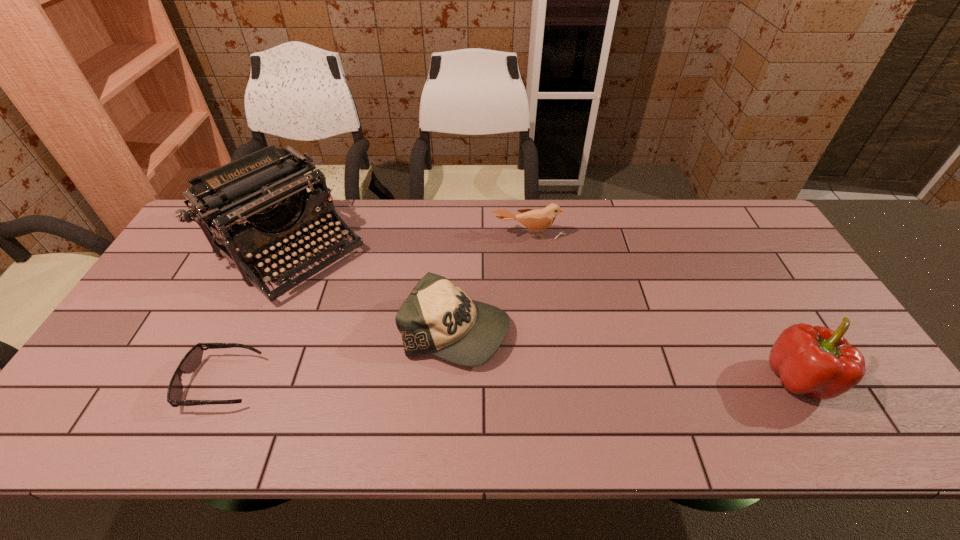
You are a GUI agent. You are given a task and a screenshot of the screen. Output one action in this format:
    pyautogui.click(x=<x>, y=<y>)
    Task: Click on the sunglasses
    
    Given the screenshot: What is the action you would take?
    pyautogui.click(x=189, y=363)

Where is `the rightmost object`? The image size is (960, 540). the rightmost object is located at coordinates (817, 361).

The width and height of the screenshot is (960, 540). Identify the location of pepper. tap(817, 361).

Locate an element on the screen. bird is located at coordinates (537, 220).

Find the location of a particular element. The width and height of the screenshot is (960, 540). typewriter is located at coordinates (262, 198).

At what (x,y) coordinates should I click in order to perform the action: click on baseball cap. Please return your answer as a coordinate pair (x, y). The image size is (960, 540). Looking at the image, I should click on (439, 318).

You are a GUI agent. You are given a task and a screenshot of the screen. Output one action in this format:
    pyautogui.click(x=<x>, y=<y>)
    Task: Click on the free location located 0.050m on the front-facing side of the sunglasses
    The image size is (960, 540).
    Given the screenshot: What is the action you would take?
    pyautogui.click(x=277, y=382)

Where is `free space located on the back of the pepper`? free space located on the back of the pepper is located at coordinates (725, 248).

You are a GUI agent. You are given a task and a screenshot of the screen. Output one action in this format:
    pyautogui.click(x=<x>, y=<y>)
    Task: Click on the free region located at the beak of the bird
    
    Given the screenshot: What is the action you would take?
    pyautogui.click(x=530, y=254)

You are a GUI agent. You are given a task and a screenshot of the screen. Output one action in this format:
    pyautogui.click(x=<x>, y=<y>)
    Task: Click on the vacant region located at the beak of the bird
    
    Given the screenshot: What is the action you would take?
    pyautogui.click(x=534, y=306)